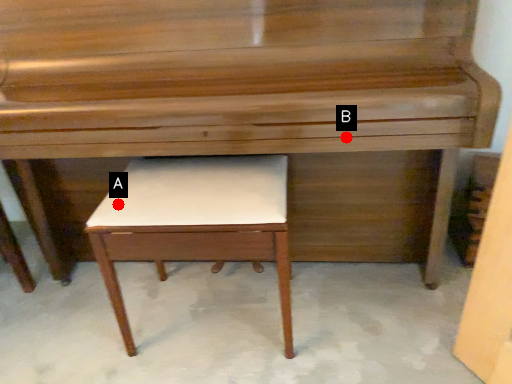
Question: Two points are circled on the image, labeled by A and B beside each circle. Which point is closer to the camera?

Choices:
 (A) A is closer
 (B) B is closer

Answer: (B)